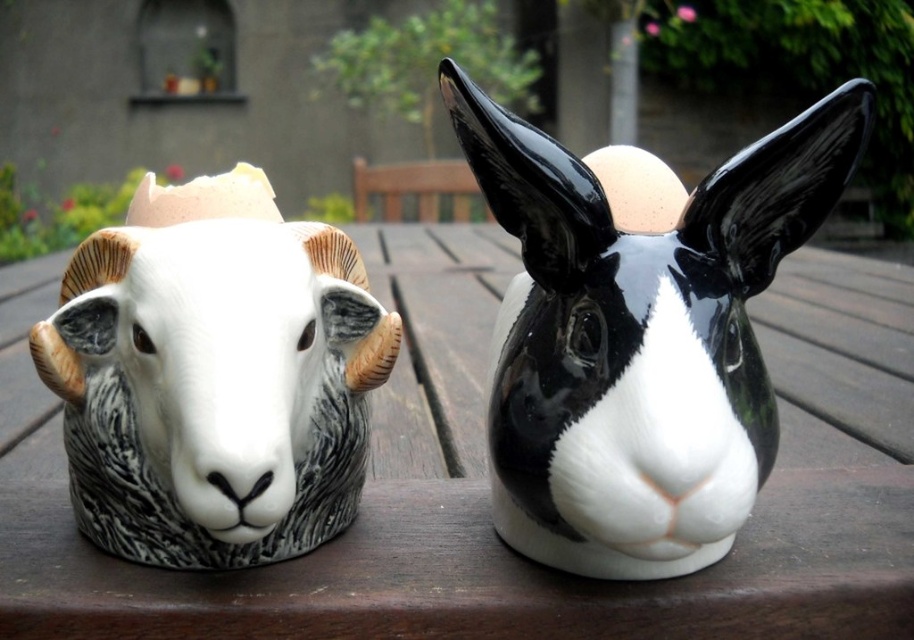
Question: Which of the following is the closest to the observer?

Choices:
 (A) (819, 381)
 (B) (645, 163)
 (C) (307, 502)

Answer: (C)

Question: Among these objects, which one is farthest from the camera?

Choices:
 (A) white glossy ram head at left
 (B) black glossy ram head at center
 (C) wooden picnic table at center

Answer: (C)

Question: Does black glossy ram head at center have a lesser width compared to white glossy ram head at left?

Choices:
 (A) yes
 (B) no

Answer: (B)

Question: Is wooden picnic table at center further to the viewer compared to black glossy ram head at center?

Choices:
 (A) no
 (B) yes

Answer: (B)

Question: Is black glossy ram head at center bigger than white glossy ram head at left?

Choices:
 (A) yes
 (B) no

Answer: (A)

Question: Which is nearer to the black glossy ram head at center?

Choices:
 (A) wooden picnic table at center
 (B) white glossy ram head at left

Answer: (B)